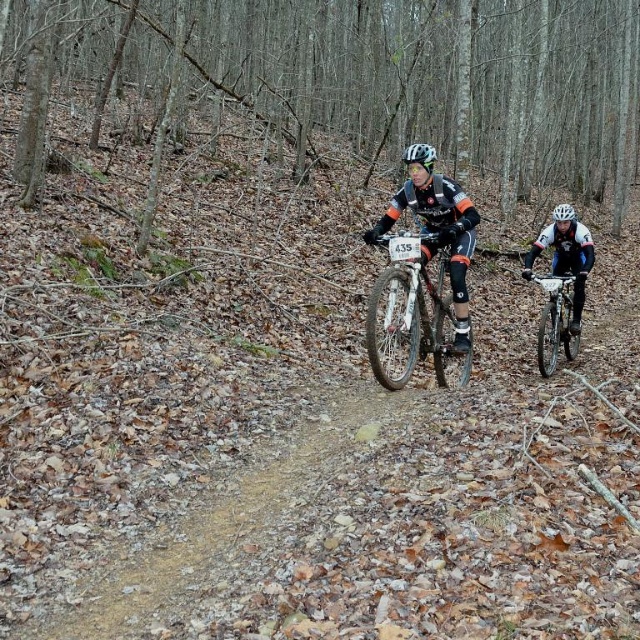
Measure the distance from white matte helmet at upper right to white matte bicycle helmet at center.

white matte helmet at upper right is 1.15 meters away from white matte bicycle helmet at center.

Is white matte helmet at upper right closer to camera compared to white matte bicycle helmet at center?

Yes, it is in front of white matte bicycle helmet at center.

Between point (588, 244) and point (556, 208), which one is positioned in front?

Point (588, 244) is in front.

Where is `white matte helmet at upper right`? Image resolution: width=640 pixels, height=640 pixels. white matte helmet at upper right is located at coordinates (564, 259).

Who is more forward, (550, 308) or (429, 161)?

Point (429, 161)

Measure the distance between shiny silver bicycle at right and camera.

shiny silver bicycle at right and camera are 6.71 meters apart from each other.

Who is more forward, (556, 310) or (429, 164)?

Positioned in front is point (429, 164).

This screenshot has height=640, width=640. In order to click on shiny silver bicycle at right in this screenshot , I will do `click(556, 321)`.

Between shiny metallic bicycle at center and white matte helmet at upper right, which one appears on the right side from the viewer's perspective?

white matte helmet at upper right

At what (x,y) coordinates should I click in order to perform the action: click on shiny metallic bicycle at center. Please return your answer as a coordinate pair (x, y). Looking at the image, I should click on (412, 314).